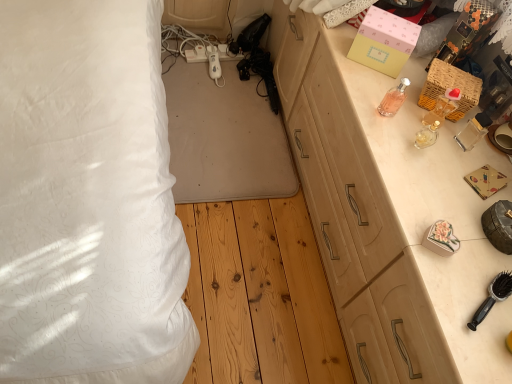
This screenshot has height=384, width=512. I want to click on vacant area that lies between translucent glass perfume at right, the second perfume from the left, and woven wicker basket at upper right, which is the second box from left to right, so click(x=417, y=125).